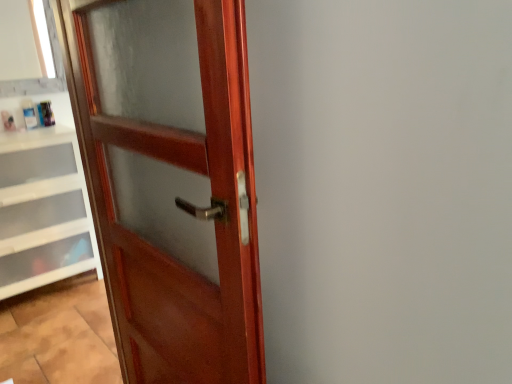
Question: Is white plastic drawers at lower left wider than matte wood window frame at upper left?

Choices:
 (A) no
 (B) yes

Answer: (B)

Question: Considering the relative sizes of white plastic drawers at lower left and matte wood window frame at upper left in the image provided, is white plastic drawers at lower left smaller than matte wood window frame at upper left?

Choices:
 (A) yes
 (B) no

Answer: (B)

Question: Is white plastic drawers at lower left to the right of matte wood window frame at upper left from the viewer's perspective?

Choices:
 (A) yes
 (B) no

Answer: (A)

Question: Can you confirm if white plastic drawers at lower left is positioned to the left of matte wood window frame at upper left?

Choices:
 (A) yes
 (B) no

Answer: (B)

Question: Could you tell me if white plastic drawers at lower left is facing matte wood window frame at upper left?

Choices:
 (A) yes
 (B) no

Answer: (B)

Question: Is matte wood window frame at upper left surrounded by white plastic drawers at lower left?

Choices:
 (A) no
 (B) yes

Answer: (A)

Question: Does matte wood window frame at upper left lie behind glossy wood door at left?

Choices:
 (A) no
 (B) yes

Answer: (B)

Question: From a real-world perspective, is matte wood window frame at upper left below glossy wood door at left?

Choices:
 (A) yes
 (B) no

Answer: (B)

Question: Is matte wood window frame at upper left smaller than glossy wood door at left?

Choices:
 (A) yes
 (B) no

Answer: (A)

Question: Does matte wood window frame at upper left have a greater width compared to glossy wood door at left?

Choices:
 (A) yes
 (B) no

Answer: (B)

Question: Does matte wood window frame at upper left contain glossy wood door at left?

Choices:
 (A) yes
 (B) no

Answer: (B)

Question: Is matte wood window frame at upper left facing away from glossy wood door at left?

Choices:
 (A) no
 (B) yes

Answer: (A)

Question: Considering the relative sizes of glossy wood door at left and matte wood window frame at upper left in the image provided, is glossy wood door at left bigger than matte wood window frame at upper left?

Choices:
 (A) yes
 (B) no

Answer: (A)